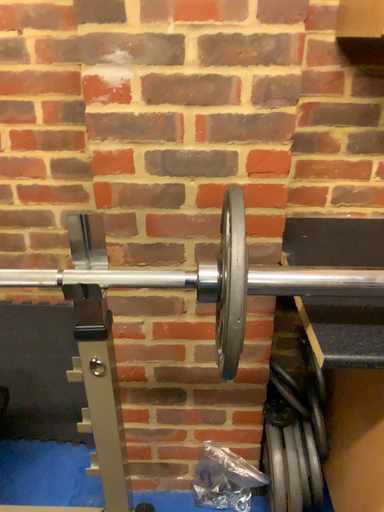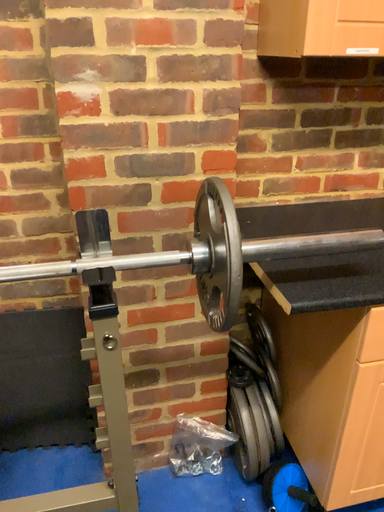
Question: How did the camera likely rotate when shooting the video?

Choices:
 (A) rotated left
 (B) rotated right

Answer: (B)